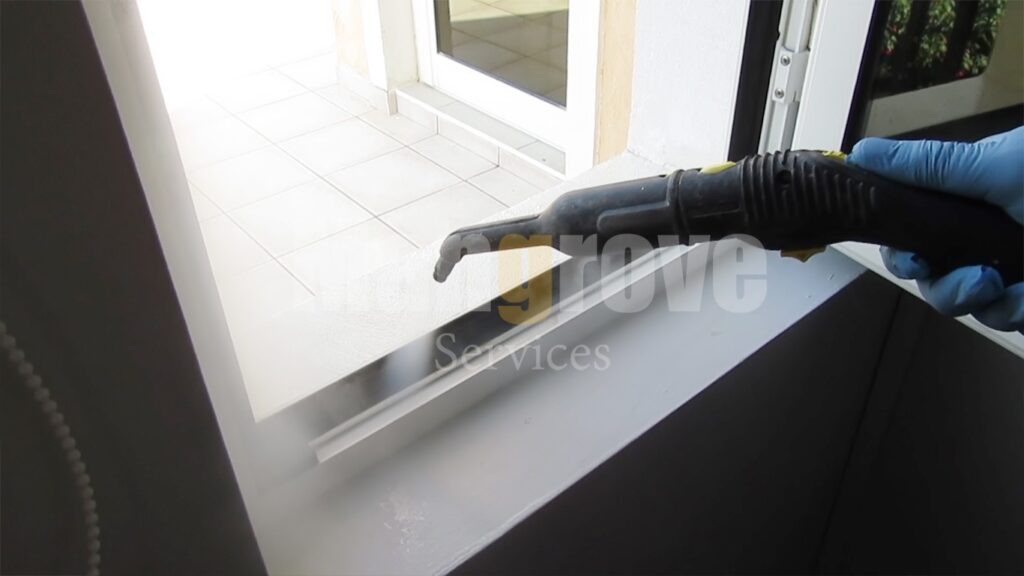
The height and width of the screenshot is (576, 1024). I want to click on white window ledge, so click(x=584, y=432).